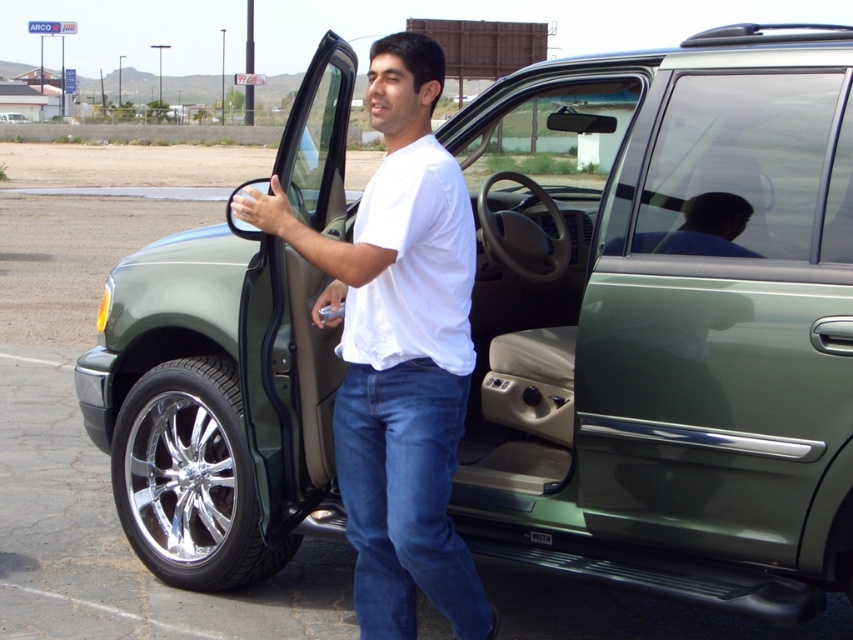
Question: Can you confirm if white cotton shirt at center is positioned below green metallic suv at center?

Choices:
 (A) yes
 (B) no

Answer: (A)

Question: Which point is closer to the camera?

Choices:
 (A) satin green door at lower right
 (B) white cotton shirt at center
 (C) green metallic suv at center

Answer: (B)

Question: Which point is farther to the camera?

Choices:
 (A) (16, 120)
 (B) (410, 184)

Answer: (A)

Question: Which object is closer to the camera taking this photo?

Choices:
 (A) satin green door at lower right
 (B) green metallic suv at center
 (C) white cotton shirt at center

Answer: (C)

Question: Can you confirm if white cotton shirt at center is positioned above green metallic suv at center?

Choices:
 (A) no
 (B) yes

Answer: (A)

Question: Is satin green door at lower right positioned at the back of green metallic suv at center?

Choices:
 (A) yes
 (B) no

Answer: (B)